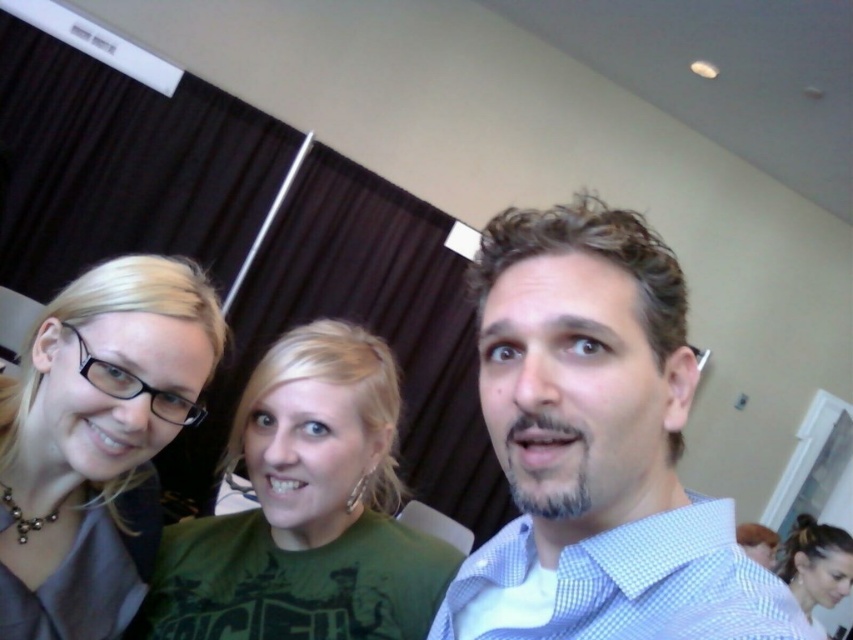
You are a photographer trying to capture a clear shot of the light blue checkered shirt at center and the matte black glasses at left. Which object should you focus on first if you want to ensure both are in focus?

The light blue checkered shirt at center should be focused on first because it has a greater height compared to the matte black glasses at left, making it more prominent in the frame.

You are taking a photo of the group and want to ensure the light blue checkered shirt at center and the matte black glasses at left are both clearly visible. Based on their positions, which object is closer to the camera?

The light blue checkered shirt at center is closer to the camera because it is in front of the matte black glasses at left.